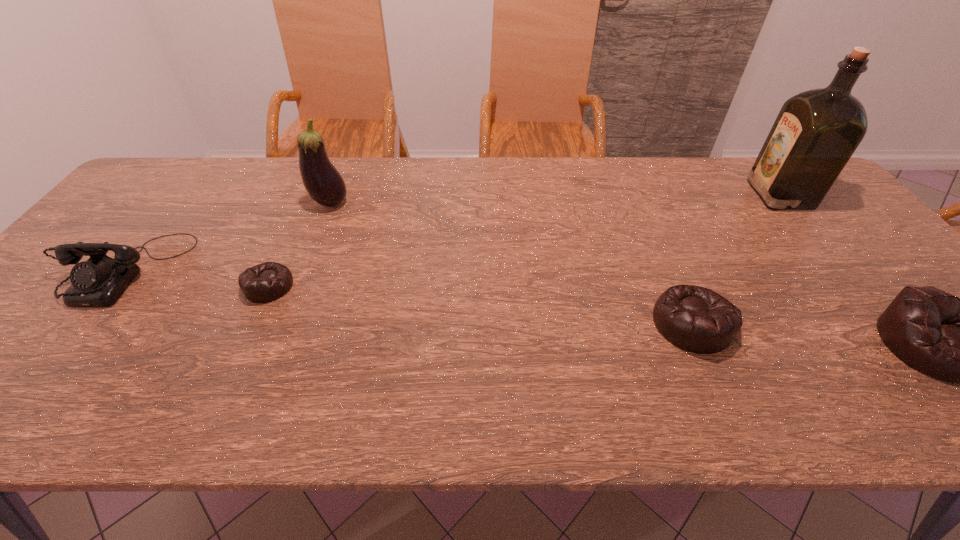
To achieve even spacing by inserting another beanbag among them, please point to a vacant spot for this new beanbag. Please provide its 2D coordinates. Your answer should be formatted as a tuple, i.e. [(x, y)], where the tuple contains the x and y coordinates of a point satisfying the conditions above.

[(472, 304)]